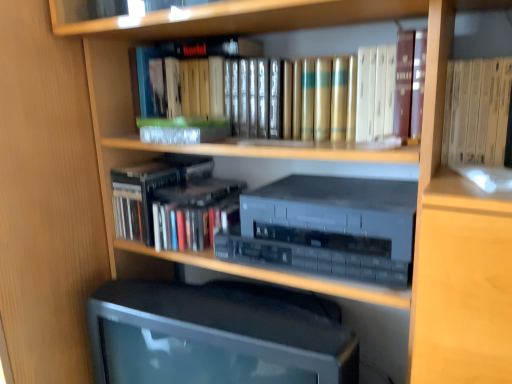
Question: Is point (181, 165) positioned closer to the camera than point (117, 332)?

Choices:
 (A) closer
 (B) farther

Answer: (B)

Question: Is hardcover books at center, which ranks as the second book in top-to-bottom order, wider or thinner than matte black monitor at center?

Choices:
 (A) thin
 (B) wide

Answer: (B)

Question: Which is nearer to the gold leather book at center, positioned as the second book in bottom-to-top order?

Choices:
 (A) matte black monitor at center
 (B) satin silver stereo at center
 (C) hardcover books at center, which appears as the first book when ordered from the bottom

Answer: (B)

Question: Which is farther from the satin silver stereo at center?

Choices:
 (A) gold leather book at center, the first book viewed from the top
 (B) hardcover books at center, which appears as the first book when ordered from the bottom
 (C) matte black monitor at center

Answer: (B)